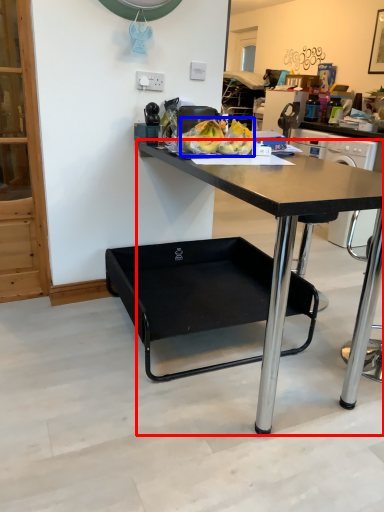
Question: Which object appears farthest to the camera in this image, desk (highlighted by a red box) or food (highlighted by a blue box)?

Choices:
 (A) desk
 (B) food

Answer: (B)